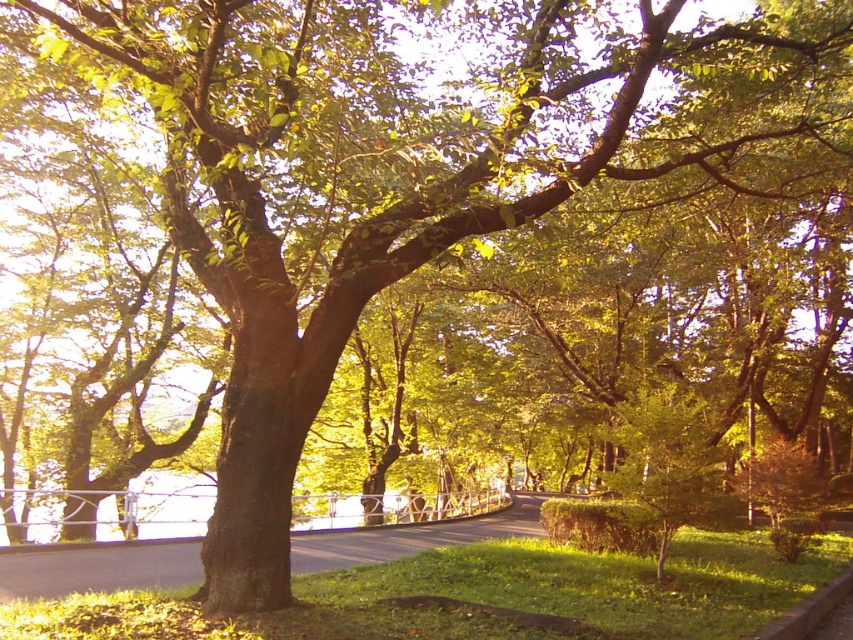
Question: Does green grass at center appear over concrete curb at lower right?

Choices:
 (A) yes
 (B) no

Answer: (B)

Question: Is green grass at center to the right of concrete curb at lower right from the viewer's perspective?

Choices:
 (A) no
 (B) yes

Answer: (A)

Question: Can you confirm if green grass at center is bigger than concrete curb at lower right?

Choices:
 (A) no
 (B) yes

Answer: (B)

Question: Which of the following is the closest to the observer?

Choices:
 (A) concrete curb at lower right
 (B) green grass at center

Answer: (A)